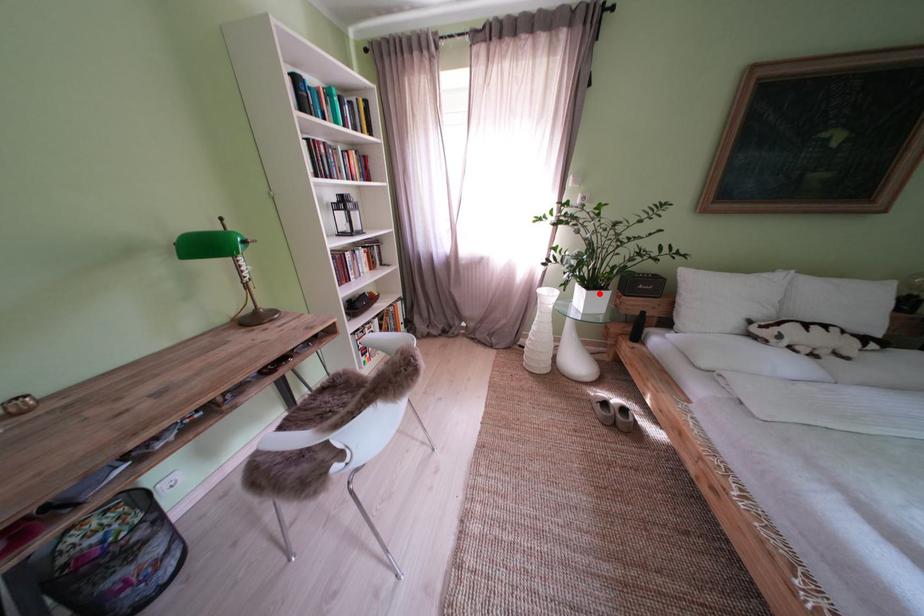
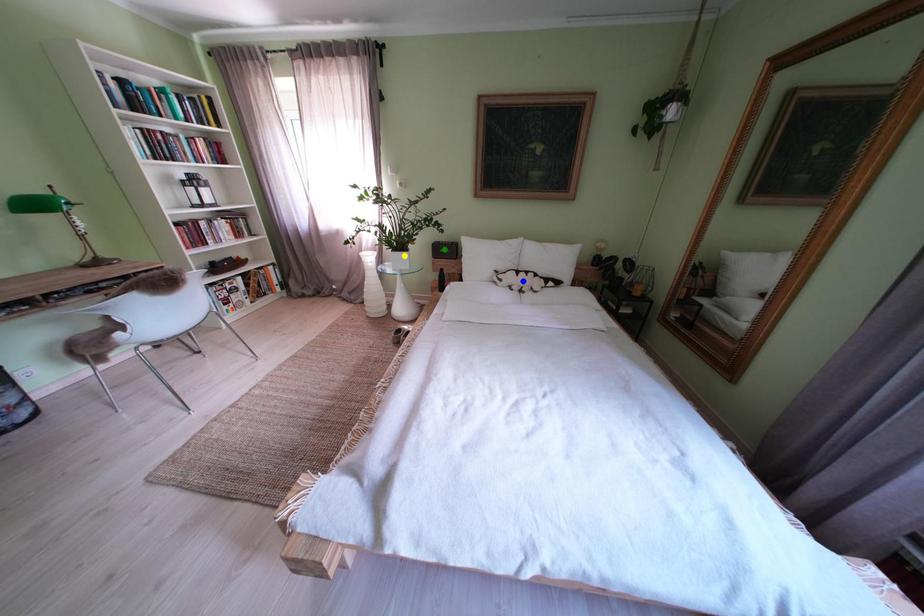
Question: I am providing you with two images of the same scene from different viewpoints. A red point is marked on the first image. You are given multiple points on the second image. Which mark in image 2 goes with the point in image 1?

Choices:
 (A) blue point
 (B) green point
 (C) yellow point

Answer: (C)